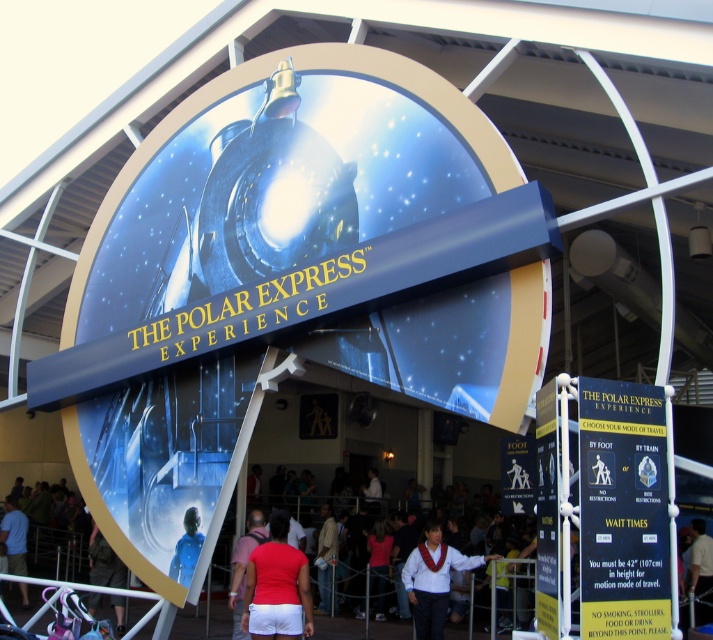
You are standing at the entrance of The Polar Express Experience and see the white satin vest at center and the blue fabric shirt at center. Which one is closer to you?

The white satin vest at center is closer to you because it is further to the viewer than the blue fabric shirt at center.

You are a costume designer preparing for a play about The Polar Express. You have two costume pieces available for the conductor character. The white satin vest at center and the blue fabric shirt at center. Which costume piece should you choose if you want the conductor to look more authoritative and commanding?

The white satin vest at center has a larger size compared to the blue fabric shirt at center, so choosing the white satin vest at center would make the conductor appear more authoritative and commanding due to its larger size.

You are standing at the entrance of The Polar Express Experience and notice two points marked on the large circular sign. The first point is at coordinates point (307, 580) and the second is at point (702, 589). Which point appears closer to you?

Point (307, 580) is closer to the camera than point (702, 589), so the first point is closer to you.